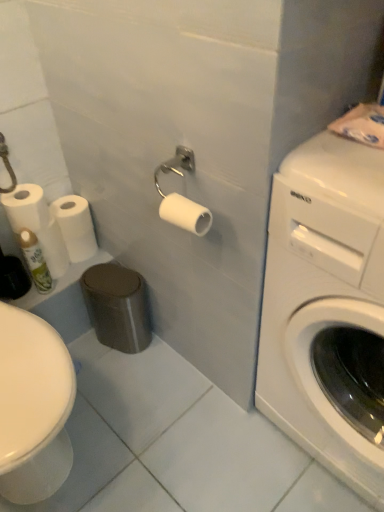
Image resolution: width=384 pixels, height=512 pixels. Describe the element at coordinates (75, 226) in the screenshot. I see `white matte toilet paper at left, arranged as the 3th toilet paper when viewed from the front` at that location.

Describe the element at coordinates (323, 298) in the screenshot. I see `white glossy washing machine at right` at that location.

What is the approximate width of white glossy washing machine at right?

It is 26.63 inches.

You are a GUI agent. You are given a task and a screenshot of the screen. Output one action in this format:
    pyautogui.click(x=<x>, y=<y>)
    Task: Click on the white matte toilet paper at left, arranged as the 3th toilet paper when viewed from the front
    Image resolution: width=384 pixels, height=512 pixels.
    Given the screenshot: What is the action you would take?
    pyautogui.click(x=75, y=226)

Between point (44, 274) and point (197, 232), which one is positioned behind?

Point (44, 274)

From the image's perspective, which one is positioned lower, green matte spray can at lower left or white matte toilet paper at center, which is counted as the third toilet paper, starting from the left?

From the image's view, green matte spray can at lower left is below.

How much distance is there between green matte spray can at lower left and white matte toilet paper at center, which is counted as the third toilet paper, starting from the left?

59.68 centimeters.

The width and height of the screenshot is (384, 512). I want to click on toiletry below the white matte toilet paper at center, which is counted as the third toilet paper, starting from the left (from the image's perspective), so click(35, 261).

Are white matte toilet paper at left, the 1th toilet paper in the back-to-front sequence, and green matte spray can at lower left making contact?

No, white matte toilet paper at left, the 1th toilet paper in the back-to-front sequence, is not with green matte spray can at lower left.

Which point is more distant from viewer, (81, 218) or (37, 251)?

The point (81, 218) is farther from the camera.

Can you tell me how much white matte toilet paper at left, arranged as the 3th toilet paper when viewed from the front, and green matte spray can at lower left differ in facing direction?

There is a 1.28-degree angle between the facing directions of white matte toilet paper at left, arranged as the 3th toilet paper when viewed from the front, and green matte spray can at lower left.

Would you consider white glossy washing machine at right to be distant from green matte spray can at lower left?

No.

Is white glossy washing machine at right to the left or to the right of green matte spray can at lower left in the image?

Clearly, white glossy washing machine at right is on the right of green matte spray can at lower left in the image.

Which point is more distant from viewer, (x=339, y=371) or (x=44, y=290)?

The point (x=44, y=290) is farther from the camera.

From the image's perspective, is white matte toilet paper at center, which appears as the first toilet paper when viewed from the right, over green matte spray can at lower left?

Yes, from the image's perspective, white matte toilet paper at center, which appears as the first toilet paper when viewed from the right, is over green matte spray can at lower left.

Looking at this image, is white matte toilet paper at center, which is the 1th toilet paper in front-to-back order, touching green matte spray can at lower left?

white matte toilet paper at center, which is the 1th toilet paper in front-to-back order, is not next to green matte spray can at lower left, and they're not touching.

What's the angular difference between white matte toilet paper at center, the 3th toilet paper when ordered from back to front, and green matte spray can at lower left's facing directions?

88.5 degrees.

Which is correct: white matte toilet paper at center, the 3th toilet paper when ordered from back to front, is inside green matte spray can at lower left, or outside of it?

The correct answer is: outside.

Does point (79, 223) come farther from viewer compared to point (13, 211)?

Yes, it is.

Is white matte toilet paper at left, acting as the 3th toilet paper starting from the right, inside white matte toilet paper at left, the 1th toilet paper in the back-to-front sequence?

Actually, white matte toilet paper at left, acting as the 3th toilet paper starting from the right, is outside white matte toilet paper at left, the 1th toilet paper in the back-to-front sequence.

From a real-world perspective, is white matte toilet paper at left, placed as the second toilet paper when sorted from right to left, located beneath white matte toilet paper at left, which is counted as the 2th toilet paper, starting from the back?

Yes, from a real-world perspective, white matte toilet paper at left, placed as the second toilet paper when sorted from right to left, is beneath white matte toilet paper at left, which is counted as the 2th toilet paper, starting from the back.

Which of these two, white matte toilet paper at left, placed as the second toilet paper when sorted from right to left, or white matte toilet paper at left, which is counted as the 2th toilet paper, starting from the back, is wider?

white matte toilet paper at left, placed as the second toilet paper when sorted from right to left, is wider.

Which point is more forward, (40, 210) or (177, 201)?

The point (177, 201) is more forward.

Could you tell me if white matte toilet paper at left, marked as the 2th toilet paper in a front-to-back arrangement, is facing white matte toilet paper at center, the 3th toilet paper when ordered from back to front?

Yes, white matte toilet paper at left, marked as the 2th toilet paper in a front-to-back arrangement, is turned towards white matte toilet paper at center, the 3th toilet paper when ordered from back to front.

Based on their sizes in the image, would you say white matte toilet paper at left, marked as the 2th toilet paper in a front-to-back arrangement, is bigger or smaller than white matte toilet paper at center, the 3th toilet paper when ordered from back to front?

Clearly, white matte toilet paper at left, marked as the 2th toilet paper in a front-to-back arrangement, is larger in size than white matte toilet paper at center, the 3th toilet paper when ordered from back to front.

Is white matte toilet paper at left, acting as the 3th toilet paper starting from the right, in front of or behind white matte toilet paper at center, the 3th toilet paper when ordered from back to front, in the image?

Visually, white matte toilet paper at left, acting as the 3th toilet paper starting from the right, is located behind white matte toilet paper at center, the 3th toilet paper when ordered from back to front.

Does white matte toilet paper at center, the 3th toilet paper when ordered from back to front, appear on the right side of white matte toilet paper at left, arranged as the 3th toilet paper when viewed from the front?

Indeed, white matte toilet paper at center, the 3th toilet paper when ordered from back to front, is positioned on the right side of white matte toilet paper at left, arranged as the 3th toilet paper when viewed from the front.

Is white matte toilet paper at center, which is the 1th toilet paper in front-to-back order, facing away from white matte toilet paper at left, placed as the second toilet paper when sorted from right to left?

That's not correct — white matte toilet paper at center, which is the 1th toilet paper in front-to-back order, is not looking away from white matte toilet paper at left, placed as the second toilet paper when sorted from right to left.

From the image's perspective, which toilet paper is the 2nd one above the green matte spray can at lower left? Please provide its 2D coordinates.

[(185, 214)]

Find the location of a particular element. The width and height of the screenshot is (384, 512). toiletry in front of the white matte toilet paper at left, placed as the second toilet paper when sorted from right to left is located at coordinates (35, 261).

When comparing their distances from white glossy washing machine at right, does white matte toilet paper at left, acting as the 3th toilet paper starting from the right, or green matte spray can at lower left seem closer?

green matte spray can at lower left lies closer to white glossy washing machine at right than the other object.

When comparing their distances from white matte toilet paper at left, positioned as the 1th toilet paper in left-to-right order, does green matte spray can at lower left or white glossy washing machine at right seem further?

white glossy washing machine at right lies further to white matte toilet paper at left, positioned as the 1th toilet paper in left-to-right order, than the other object.

From the image, which object appears to be farther from white matte toilet paper at left, placed as the second toilet paper when sorted from right to left, white matte toilet paper at center, the 3th toilet paper when ordered from back to front, or green matte spray can at lower left?

white matte toilet paper at center, the 3th toilet paper when ordered from back to front, lies further to white matte toilet paper at left, placed as the second toilet paper when sorted from right to left, than the other object.

Considering their positions, is white matte toilet paper at left, placed as the second toilet paper when sorted from left to right, positioned closer to white matte toilet paper at center, which is counted as the third toilet paper, starting from the left, than green matte spray can at lower left?

Among the two, white matte toilet paper at left, placed as the second toilet paper when sorted from left to right, is located nearer to white matte toilet paper at center, which is counted as the third toilet paper, starting from the left.

Considering their positions, is white matte toilet paper at left, marked as the 2th toilet paper in a front-to-back arrangement, positioned closer to white matte toilet paper at left, arranged as the 3th toilet paper when viewed from the front, than white glossy washing machine at right?

white matte toilet paper at left, marked as the 2th toilet paper in a front-to-back arrangement, is closer to white matte toilet paper at left, arranged as the 3th toilet paper when viewed from the front.

When comparing their distances from white matte toilet paper at left, which is counted as the 2th toilet paper, starting from the back, does white matte toilet paper at center, the 3th toilet paper when ordered from back to front, or white matte toilet paper at left, placed as the second toilet paper when sorted from right to left, seem further?

white matte toilet paper at center, the 3th toilet paper when ordered from back to front, lies further to white matte toilet paper at left, which is counted as the 2th toilet paper, starting from the back, than the other object.

Looking at the image, which one is located closer to white matte toilet paper at left, arranged as the 3th toilet paper when viewed from the front, white matte toilet paper at center, which is counted as the third toilet paper, starting from the left, or white matte toilet paper at left, which is counted as the 2th toilet paper, starting from the back?

white matte toilet paper at left, which is counted as the 2th toilet paper, starting from the back, is closer to white matte toilet paper at left, arranged as the 3th toilet paper when viewed from the front.

Looking at the image, which one is located closer to white glossy washing machine at right, white matte toilet paper at left, positioned as the 1th toilet paper in left-to-right order, or white matte toilet paper at center, the 3th toilet paper when ordered from back to front?

The object closer to white glossy washing machine at right is white matte toilet paper at center, the 3th toilet paper when ordered from back to front.

Locate an element on the screen. The image size is (384, 512). toiletry between white matte toilet paper at center, which is counted as the third toilet paper, starting from the left, and white matte toilet paper at left, placed as the second toilet paper when sorted from left to right, in the front-back direction is located at coordinates (35, 261).

At what (x,y) coordinates should I click in order to perform the action: click on toiletry located between white matte toilet paper at left, marked as the 2th toilet paper in a front-to-back arrangement, and white matte toilet paper at center, the 3th toilet paper when ordered from back to front, in the left-right direction. Please return your answer as a coordinate pair (x, y). The width and height of the screenshot is (384, 512). Looking at the image, I should click on (35, 261).

The image size is (384, 512). I want to click on toilet paper between white matte toilet paper at left, placed as the second toilet paper when sorted from left to right, and white glossy washing machine at right from left to right, so click(x=185, y=214).

This screenshot has width=384, height=512. Find the location of `toiletry between white matte toilet paper at left, acting as the 3th toilet paper starting from the right, and white glossy washing machine at right, in the horizontal direction`. toiletry between white matte toilet paper at left, acting as the 3th toilet paper starting from the right, and white glossy washing machine at right, in the horizontal direction is located at coordinates (35, 261).